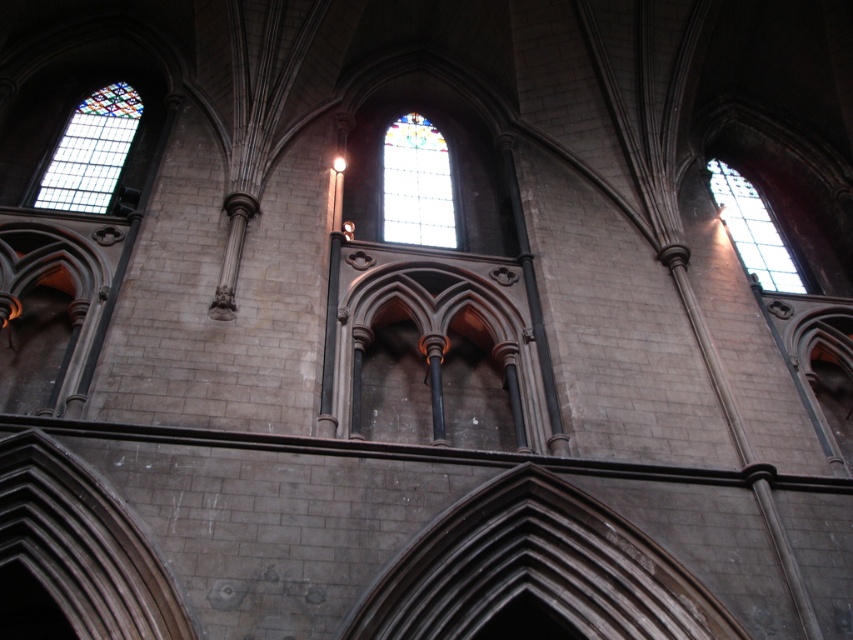
Question: From the image, what is the correct spatial relationship of stained glass window at upper left in relation to stained glass window at upper right?

Choices:
 (A) above
 (B) below

Answer: (A)

Question: Which point appears closest to the camera in this image?

Choices:
 (A) (764, 260)
 (B) (401, 195)
 (C) (64, 205)

Answer: (C)

Question: Among these points, which one is farthest from the camera?

Choices:
 (A) click(78, 205)
 (B) click(798, 276)
 (C) click(424, 179)

Answer: (C)

Question: Among these objects, which one is nearest to the camera?

Choices:
 (A) stained glass window at upper right
 (B) stained glass window at upper left

Answer: (B)

Question: Considering the relative positions of stained glass window at center and stained glass window at upper right in the image provided, where is stained glass window at center located with respect to stained glass window at upper right?

Choices:
 (A) left
 (B) right

Answer: (A)

Question: Where is stained glass window at upper left located in relation to stained glass window at upper right in the image?

Choices:
 (A) below
 (B) above

Answer: (B)